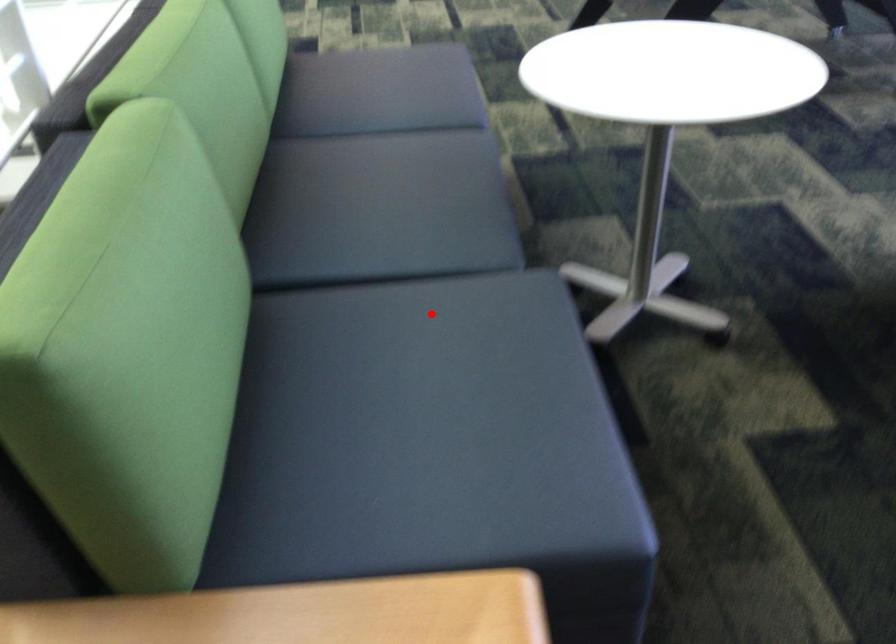
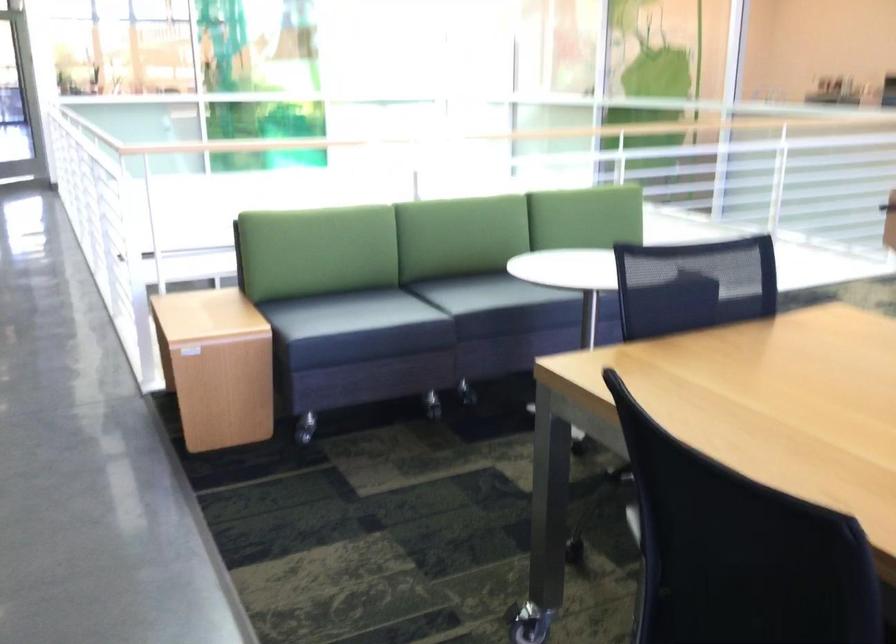
The point at the highlighted location is marked in the first image. Where is the corresponding point in the second image?

(348, 313)